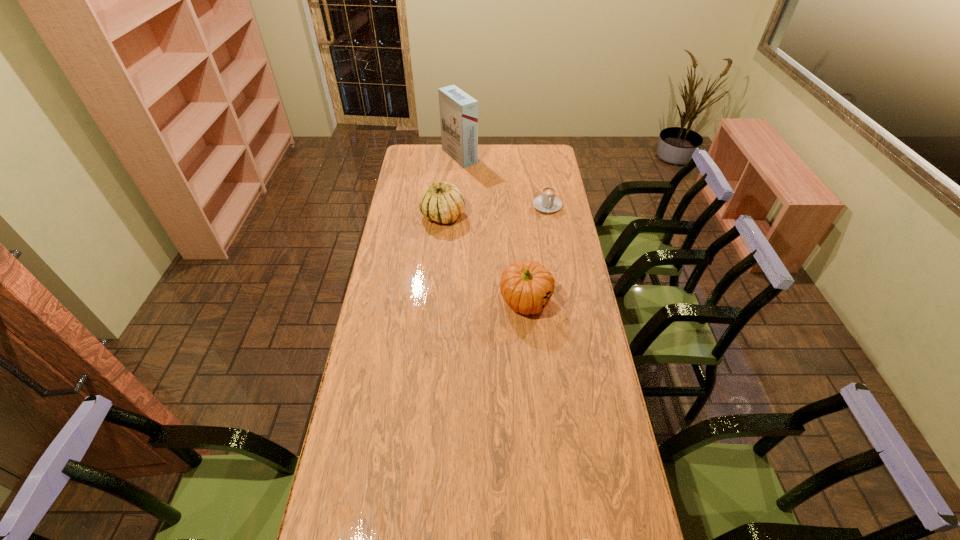
Find the location of a particular element. The image size is (960, 540). cigarette case is located at coordinates (458, 111).

The height and width of the screenshot is (540, 960). In order to click on the tallest object in this screenshot , I will do `click(458, 111)`.

Find the location of a particular element. pumpkin is located at coordinates (526, 286).

Identify the location of gourd. (442, 202).

Find the location of a particular element. the fourth tallest object is located at coordinates (547, 202).

What are the coordinates of `vacant area situated 0.110m on the left of the cigarette case` in the screenshot? It's located at (421, 157).

This screenshot has width=960, height=540. In order to click on vacant space situated 0.170m on the surface of the pumpkin in this screenshot , I will do `click(532, 363)`.

Find the location of a particular element. vacant space located 0.080m on the left of the gourd is located at coordinates (403, 216).

Locate an element on the screen. vacant space located 0.300m to the right of the fourth tallest object is located at coordinates (557, 259).

Where is `object positioned at the far edge`? object positioned at the far edge is located at coordinates (458, 111).